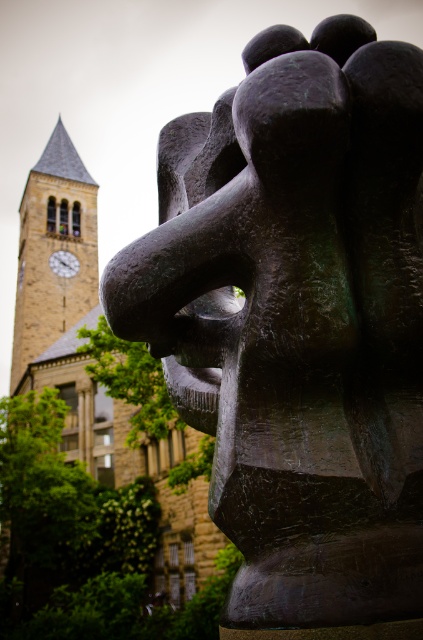
Question: Which point appears closest to the camera in this image?

Choices:
 (A) (192, 564)
 (B) (280, 60)

Answer: (B)

Question: Estimate the real-world distances between objects in this image. Which object is farther from the brown stone clock tower at upper left?

Choices:
 (A) wooden clock at upper left
 (B) bronze sculpture at center

Answer: (B)

Question: Can you confirm if bronze sculpture at center is thinner than wooden clock at upper left?

Choices:
 (A) no
 (B) yes

Answer: (B)

Question: Does brown stone clock tower at upper left have a greater width compared to wooden clock at upper left?

Choices:
 (A) no
 (B) yes

Answer: (B)

Question: Estimate the real-world distances between objects in this image. Which object is closer to the bronze sculpture at center?

Choices:
 (A) brown stone church at center
 (B) brown stone clock tower at upper left

Answer: (A)

Question: Is bronze sculpture at center smaller than brown stone clock tower at upper left?

Choices:
 (A) yes
 (B) no

Answer: (A)